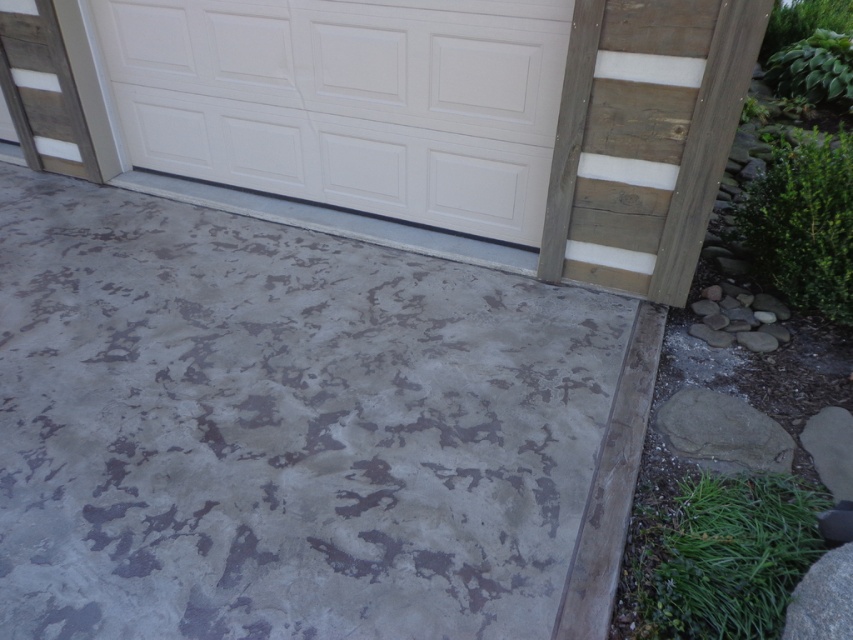
How distant is textured gray concrete at center from white painted wood door at upper center?

3.64 feet

Between textured gray concrete at center and white painted wood door at upper center, which one appears on the left side from the viewer's perspective?

textured gray concrete at center

Who is more forward, (630, 317) or (305, 156)?

Positioned in front is point (630, 317).

Where is `textured gray concrete at center`? textured gray concrete at center is located at coordinates (283, 429).